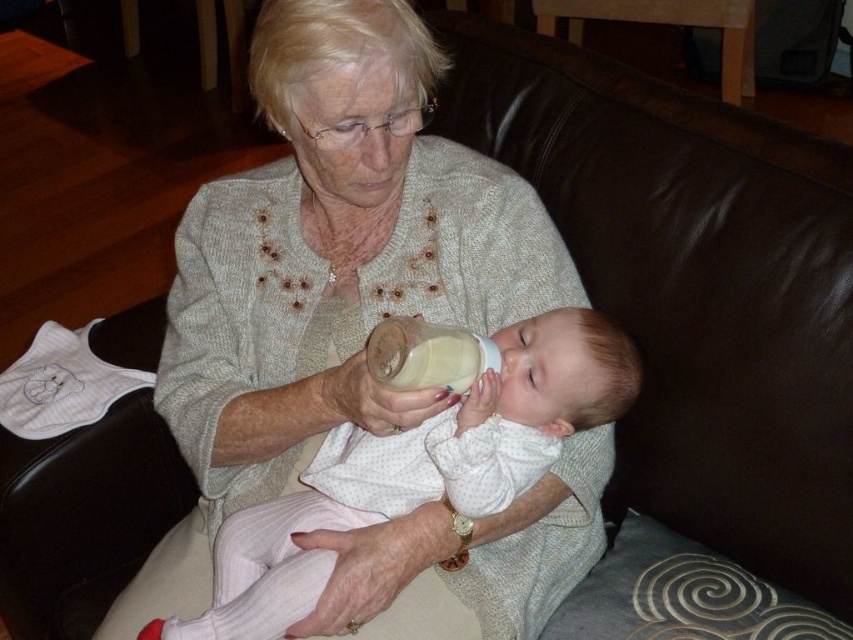
You are a photographer trying to capture a closeup shot of the baby and the bottle. You have a camera with a 20 cm wide lens. If you position the camera to frame both the white cotton baby at center and the translucent plastic bottle at center, will the lens be wide enough to include both in the photo?

The white cotton baby at center might be wider than the translucent plastic bottle at center. If the baby is wider than 20 cm, the lens might not be wide enough to capture both in the photo.

You are a pediatrician checking the feeding position of the white cotton baby at center and the translucent plastic bottle at center. Is the baby positioned at a safe distance according to the recommended 6 inches guideline?

The distance between the white cotton baby at center and the translucent plastic bottle at center is 6.03 inches, which is slightly over the recommended 6 inches guideline. Adjust the position to ensure the baby is closer for safe feeding.

You are a photographer trying to capture a closeup of the translucent plastic bottle at center and the white cotton baby at center. Which object should you focus on first if you want to ensure both are in focus?

The white cotton baby at center is located below the translucent plastic bottle at center. Since they are at different heights, you should focus on the translucent plastic bottle at center first as it is closer to the camera, ensuring both objects remain in focus.